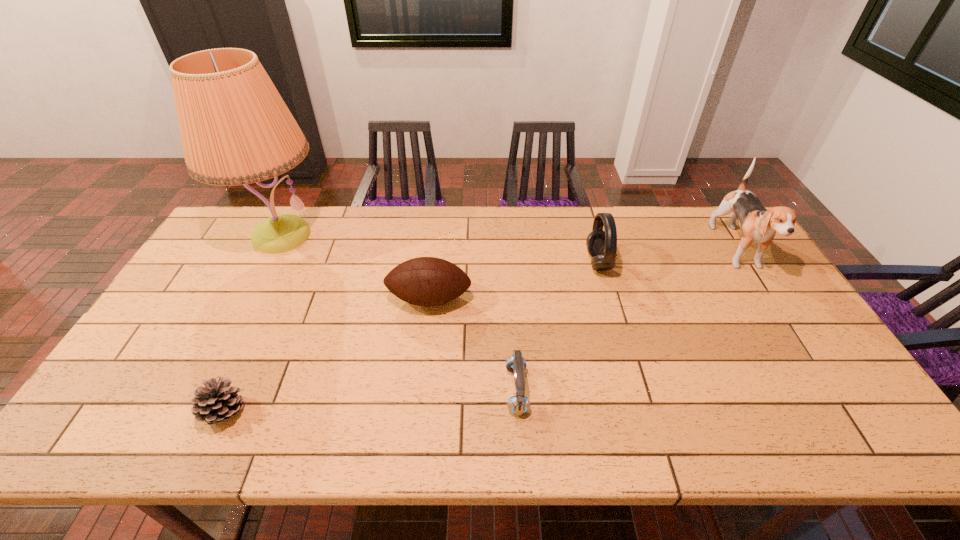
You are a GUI agent. You are given a task and a screenshot of the screen. Output one action in this format:
    pyautogui.click(x=<x>, y=<y>)
    Task: Click on the tallest object
    Image resolution: width=960 pixels, height=540 pixels.
    Given the screenshot: What is the action you would take?
    pyautogui.click(x=235, y=128)

Identify the location of puppy. (758, 225).

Find the location of a particular element. The image size is (960, 540). the fifth shortest object is located at coordinates (758, 225).

This screenshot has width=960, height=540. Find the location of `the right headset`. the right headset is located at coordinates (602, 245).

Find the location of a particular element. the fourth shortest object is located at coordinates (602, 245).

Where is `the third shortest object`? This screenshot has height=540, width=960. the third shortest object is located at coordinates (424, 281).

Locate an element on the screen. This screenshot has width=960, height=540. the third object from left to right is located at coordinates (424, 281).

Image resolution: width=960 pixels, height=540 pixels. I want to click on pinecone, so click(x=217, y=402).

Identify the location of the left headset. Image resolution: width=960 pixels, height=540 pixels. (518, 404).

You are a GUI agent. You are given a task and a screenshot of the screen. Output one action in this format:
    pyautogui.click(x=<x>, y=<y>)
    Task: Click on the third object from right to left
    
    Given the screenshot: What is the action you would take?
    pyautogui.click(x=518, y=404)